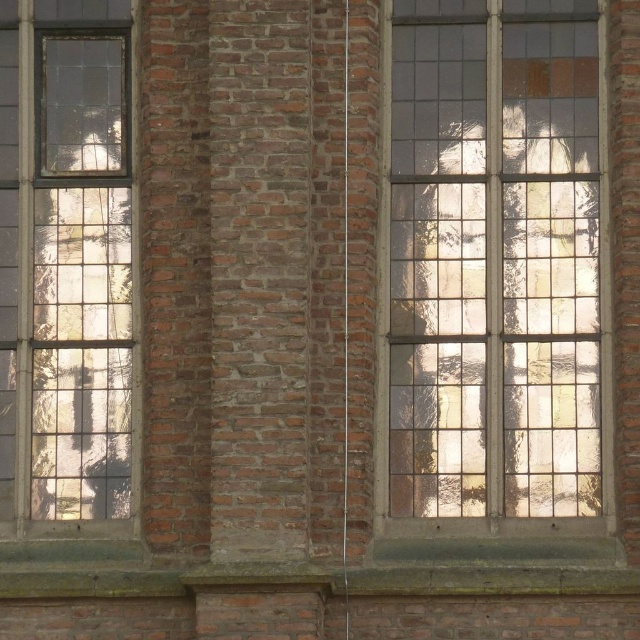
Is point (531, 76) positioned before point (33, 22)?

That is True.

Is stained glass window at center behind stained glass window at left?

No, it is not.

Is point (458, 35) positioned after point (20, 301)?

Yes, it is.

Locate an element on the screen. stained glass window at center is located at coordinates (493, 268).